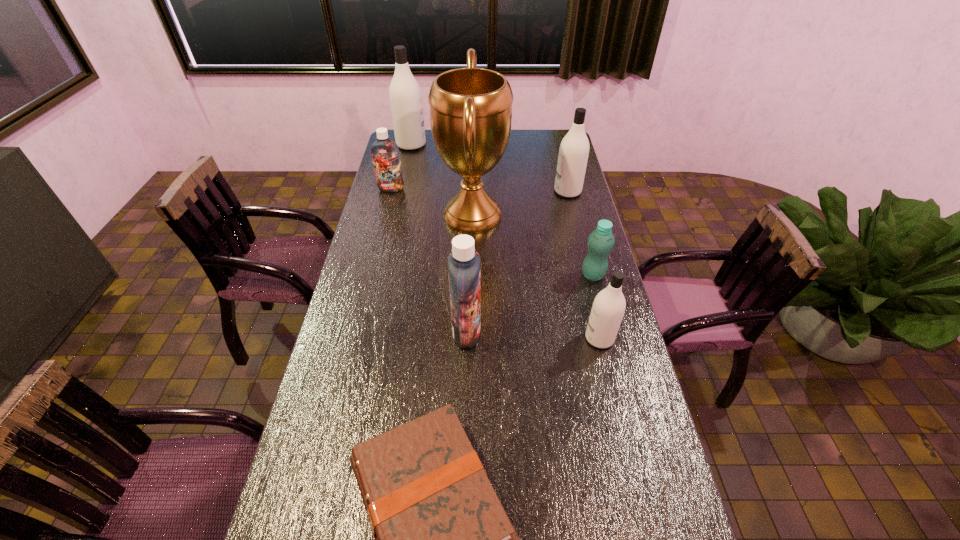
Find the location of a particular element. trophy cup is located at coordinates (470, 108).

At what (x,y) coordinates should I click in order to perform the action: click on gold trophy cup. Please return your answer as a coordinate pair (x, y). This screenshot has width=960, height=540. Looking at the image, I should click on (470, 108).

Where is `the tallest shampoo`? This screenshot has width=960, height=540. the tallest shampoo is located at coordinates (405, 95).

Identify the location of the biggest white shampoo. This screenshot has height=540, width=960. (405, 95).

Where is `the right blue shampoo`? the right blue shampoo is located at coordinates (464, 262).

The height and width of the screenshot is (540, 960). In order to click on the third shampoo from left to right in this screenshot , I will do `click(464, 262)`.

Identify the location of the second nearest white shampoo. (573, 154).

The height and width of the screenshot is (540, 960). In order to click on the nearest white shampoo in this screenshot , I will do `click(608, 308)`.

In order to click on the smaller blue shampoo in this screenshot , I will do `click(385, 153)`.

Where is `the farther blue shampoo`? Image resolution: width=960 pixels, height=540 pixels. the farther blue shampoo is located at coordinates (385, 153).